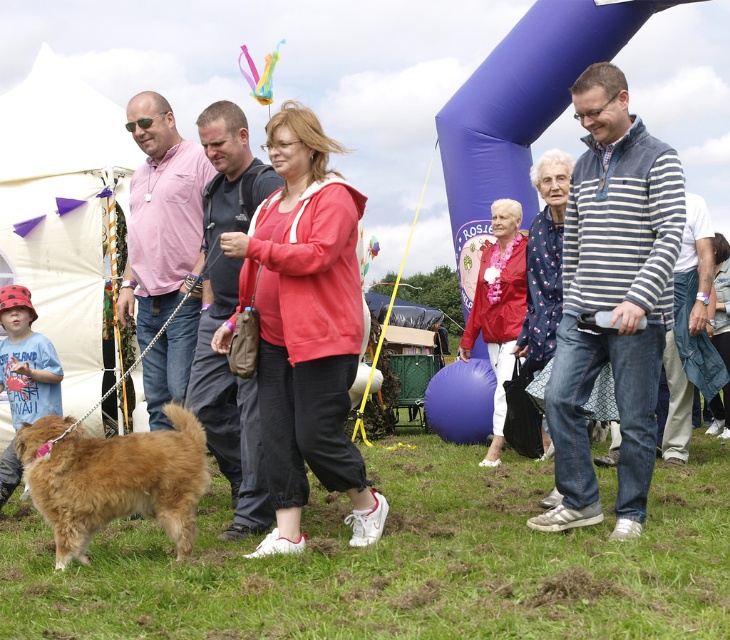
Question: Is striped cotton shirt at center positioned at the back of golden fur dog at lower left?

Choices:
 (A) yes
 (B) no

Answer: (A)

Question: Which point appears farthest from the camera in this image?

Choices:
 (A) (161, 376)
 (B) (599, 88)
 (C) (207, 358)
 (D) (123, 474)

Answer: (A)

Question: Which object appears closest to the camera in this image?

Choices:
 (A) striped cotton shirt at center
 (B) pink cotton shirt at center

Answer: (A)

Question: Does golden fur dog at lower left have a greater width compared to pink cotton shirt at center?

Choices:
 (A) yes
 (B) no

Answer: (A)

Question: Can you confirm if striped cotton shirt at center is bigger than golden fur dog at lower left?

Choices:
 (A) no
 (B) yes

Answer: (B)

Question: Which object is closer to the camera taking this photo?

Choices:
 (A) pink cotton shirt at center
 (B) dark gray cotton shirt at center
 (C) golden fur dog at lower left
 (D) striped cotton shirt at center

Answer: (C)